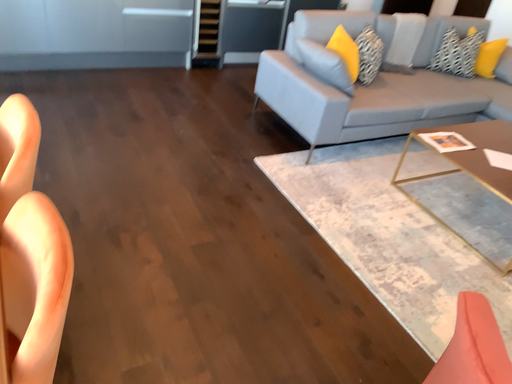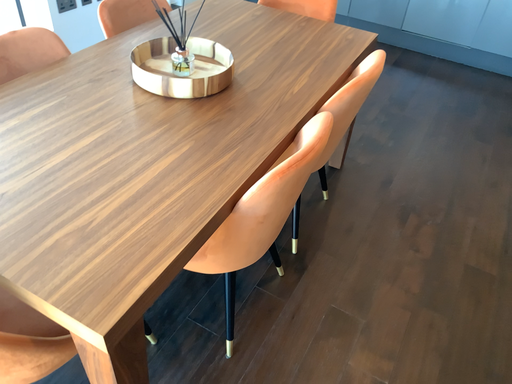
Question: How did the camera likely rotate when shooting the video?

Choices:
 (A) rotated downward
 (B) rotated upward

Answer: (B)